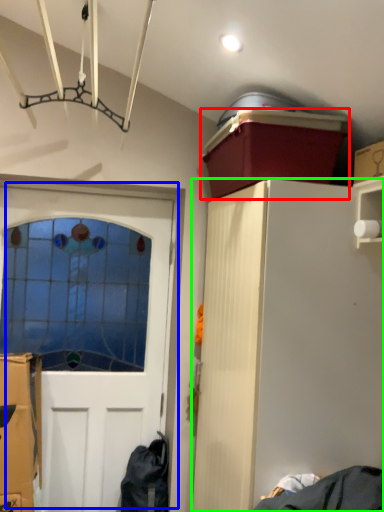
Question: Which object is positioned closest to box (highlighted by a red box)? Select from door (highlighted by a blue box) and cabinetry (highlighted by a green box).

Choices:
 (A) door
 (B) cabinetry

Answer: (B)